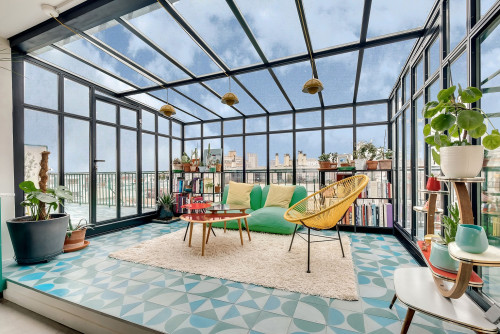
You are a GUI agent. You are given a task and a screenshot of the screen. Output one action in this format:
    pyautogui.click(x=<x>, y=<y>)
    Task: Click on the couch
    The width and height of the screenshot is (500, 334).
    Given the screenshot: What is the action you would take?
    pyautogui.click(x=267, y=213)